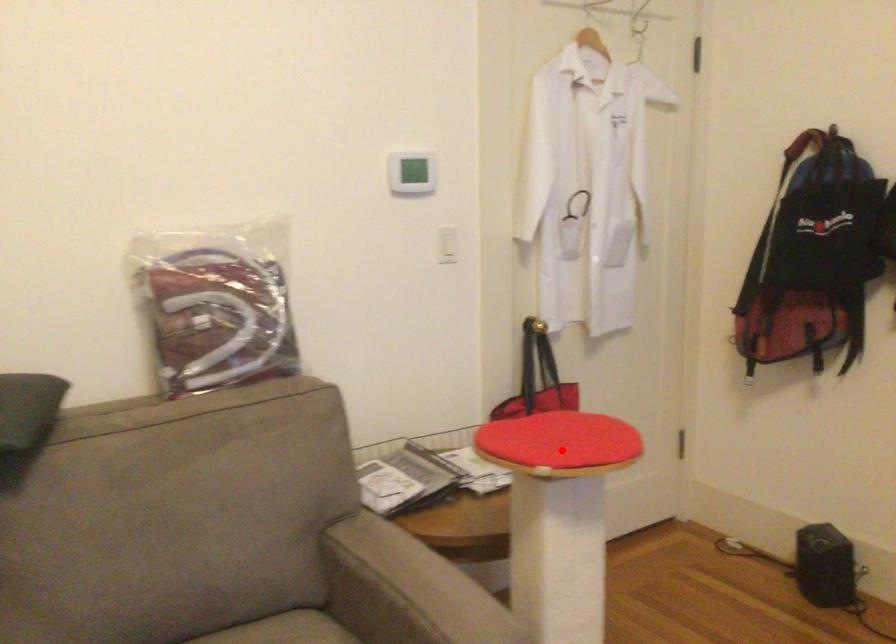
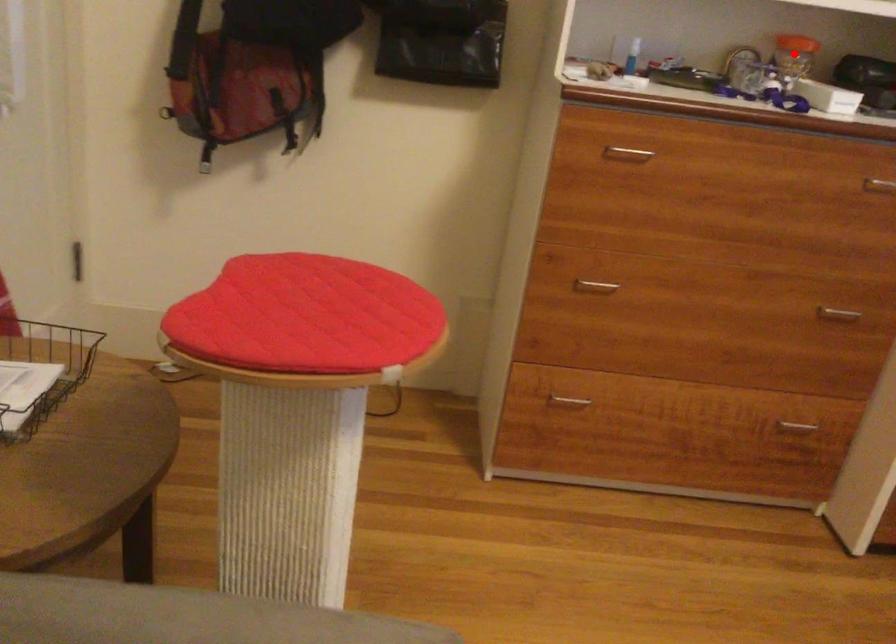
I am providing you with two images of the same scene from different viewpoints. A red point is marked on the first image and another point is marked on the second image. Is the marked point in image1 the same physical position as the marked point in image2?

No